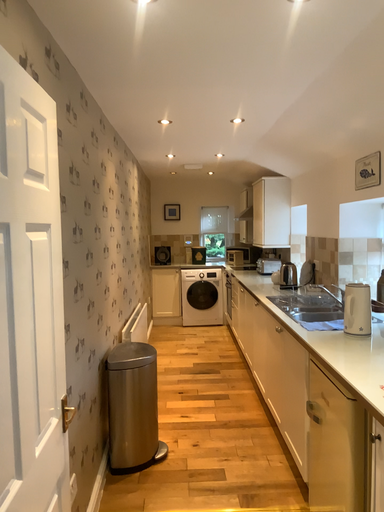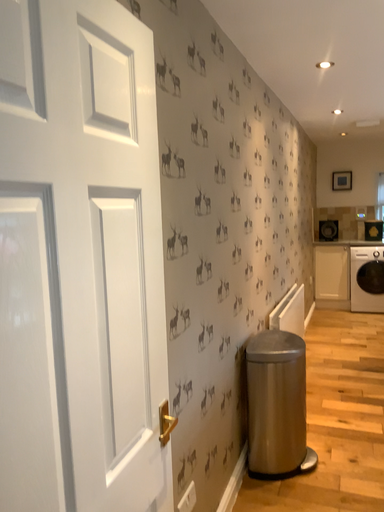
Question: How did the camera likely rotate when shooting the video?

Choices:
 (A) rotated right
 (B) rotated left

Answer: (B)